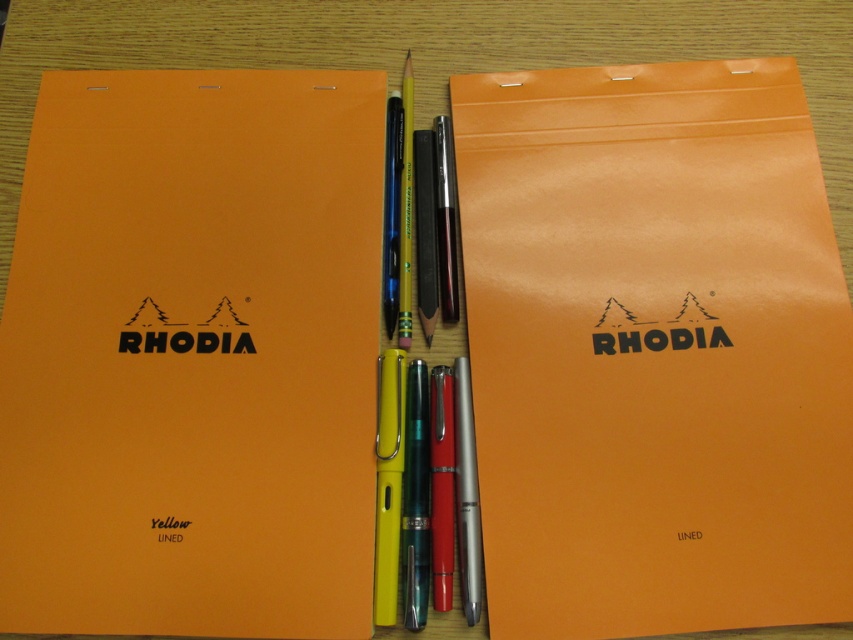
You are standing at the point labeled as point (590, 93). You want to pick up the yellow pencil and the blue pen which are placed between the two notebooks. Can you reach them without moving your position?

The distance between you and the point labeled as point (590, 93) is 36.74 inches, so you can easily reach the yellow pencil and blue pen placed between the two notebooks without moving your position.

Looking at this image, you are organizing a stationery store shelf and need to place the orange matte rhodia notebook at center and the matte orange notebook at left. If the shelf has a height limit of 15 cm, and the smaller notebook is 10 cm tall, can both notebooks fit vertically on the shelf without exceeding the height limit?

The orange matte rhodia notebook at center is larger in size than the matte orange notebook at left. Since the smaller notebook is 10 cm tall, the larger one must be taller than 10 cm. If both are placed vertically, their combined height would exceed the 15 cm limit because the larger notebook alone might already be taller than 15 cm or together with the smaller one surpass the limit. Thus, they cannot both fit vertically without exceeding the height limit.

You are organizing a stationery store shelf and need to stack the orange matte rhodia notebook at center and the matte orange notebook at left vertically. Which notebook should you place at the bottom to ensure stability?

The orange matte rhodia notebook at center should be placed at the bottom because it has a greater height than the matte orange notebook at left, providing a more stable base for stacking.